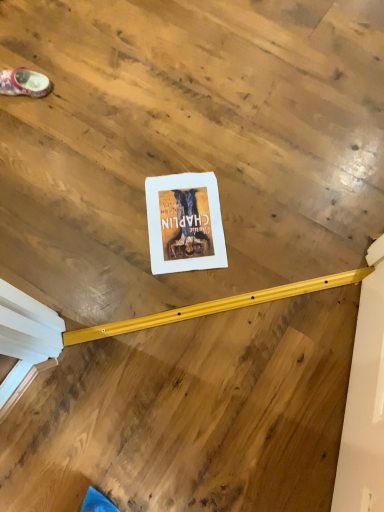
Question: Should I look upward or downward to see matte pink fabric slipper at upper left?

Choices:
 (A) down
 (B) up

Answer: (B)

Question: Considering the relative sizes of matte pink fabric slipper at upper left and white paper at center in the image provided, is matte pink fabric slipper at upper left smaller than white paper at center?

Choices:
 (A) no
 (B) yes

Answer: (A)

Question: Does matte pink fabric slipper at upper left turn towards white paper at center?

Choices:
 (A) no
 (B) yes

Answer: (A)

Question: Is matte pink fabric slipper at upper left further to camera compared to white paper at center?

Choices:
 (A) yes
 (B) no

Answer: (A)

Question: Does matte pink fabric slipper at upper left appear on the left side of white paper at center?

Choices:
 (A) yes
 (B) no

Answer: (A)

Question: Can you confirm if matte pink fabric slipper at upper left is thinner than white paper at center?

Choices:
 (A) no
 (B) yes

Answer: (B)

Question: From the image's perspective, is matte pink fabric slipper at upper left on white paper at center?

Choices:
 (A) no
 (B) yes

Answer: (B)

Question: Can you confirm if white paper at center is bigger than matte pink fabric slipper at upper left?

Choices:
 (A) no
 (B) yes

Answer: (A)

Question: Can you confirm if white paper at center is smaller than matte pink fabric slipper at upper left?

Choices:
 (A) yes
 (B) no

Answer: (A)

Question: Is white paper at center not within matte pink fabric slipper at upper left?

Choices:
 (A) yes
 (B) no

Answer: (A)

Question: Is white paper at center in front of matte pink fabric slipper at upper left?

Choices:
 (A) no
 (B) yes

Answer: (B)

Question: Does white paper at center appear on the left side of matte pink fabric slipper at upper left?

Choices:
 (A) no
 (B) yes

Answer: (A)

Question: From a real-world perspective, does white paper at center sit lower than matte pink fabric slipper at upper left?

Choices:
 (A) yes
 (B) no

Answer: (A)

Question: Considering the relative positions of white paper at center and matte pink fabric slipper at upper left in the image provided, is white paper at center to the left or to the right of matte pink fabric slipper at upper left?

Choices:
 (A) left
 (B) right

Answer: (B)